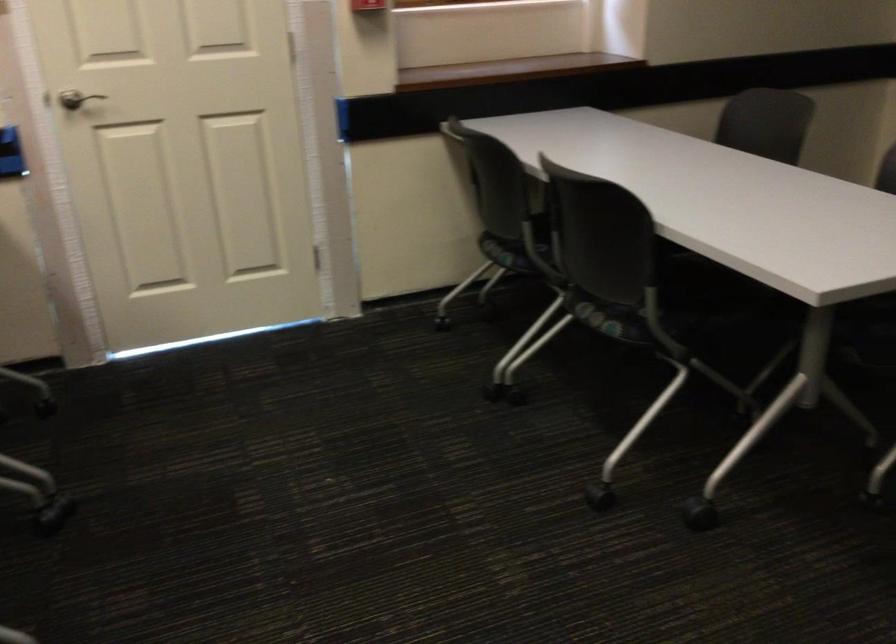
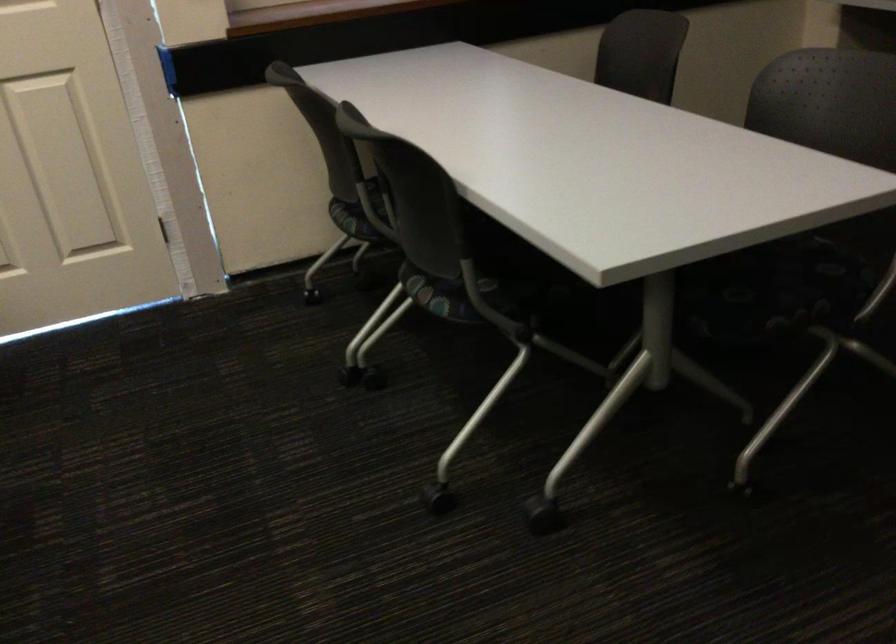
The point at (504, 254) is marked in the first image. Where is the corresponding point in the second image?

(350, 220)